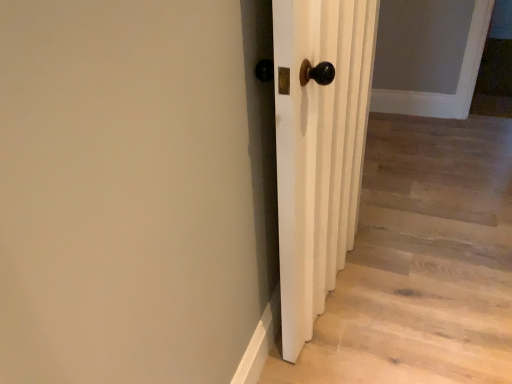
Describe the element at coordinates (318, 149) in the screenshot. I see `white wooden door at center` at that location.

Find the location of a particular element. The height and width of the screenshot is (384, 512). white wooden door at center is located at coordinates (318, 149).

The height and width of the screenshot is (384, 512). Identify the location of white matte door at center. (421, 263).

Image resolution: width=512 pixels, height=384 pixels. What do you see at coordinates (421, 263) in the screenshot?
I see `white matte door at center` at bounding box center [421, 263].

Find the location of a particular element. white wooden door at center is located at coordinates (318, 149).

Which object is positioned more to the left, white matte door at center or white wooden door at center?

Positioned to the left is white wooden door at center.

Which object is more forward, white matte door at center or white wooden door at center?

white wooden door at center is more forward.

Does point (368, 238) appear closer or farther from the camera than point (342, 36)?

Point (368, 238).

From the image's perspective, is white matte door at center above or below white wooden door at center?

white matte door at center is situated lower than white wooden door at center in the image.

From a real-world perspective, is white matte door at center on white wooden door at center?

No, from a real-world perspective, white matte door at center is not above white wooden door at center.

Can you confirm if white matte door at center is thinner than white wooden door at center?

No.

Considering the relative sizes of white matte door at center and white wooden door at center in the image provided, is white matte door at center taller than white wooden door at center?

No, white matte door at center is not taller than white wooden door at center.

Between white matte door at center and white wooden door at center, which one has smaller size?

With smaller size is white matte door at center.

Consider the image. Which is correct: white matte door at center is inside white wooden door at center, or outside of it?

white matte door at center is not inside white wooden door at center, it's outside.

Are white matte door at center and white wooden door at center far apart?

No.

From the picture: Could you tell me if white matte door at center is turned towards white wooden door at center?

No.

How distant is white matte door at center from white wooden door at center?

A distance of 51.02 centimeters exists between white matte door at center and white wooden door at center.

Locate an element on the screen. The height and width of the screenshot is (384, 512). stairwell located on the right of white wooden door at center is located at coordinates pyautogui.click(x=421, y=263).

Which object is positioned more to the right, white wooden door at center or white matte door at center?

white matte door at center is more to the right.

Between white wooden door at center and white matte door at center, which one is positioned behind?

white matte door at center.

Which point is more forward, (333,274) or (362,198)?

The point (333,274) is closer.

From the image's perspective, which is below, white wooden door at center or white matte door at center?

white matte door at center, from the image's perspective.

From a real-world perspective, is white wooden door at center on top of white matte door at center?

Yes, from a real-world perspective, white wooden door at center is above white matte door at center.

Considering the sizes of white wooden door at center and white matte door at center in the image, is white wooden door at center wider or thinner than white matte door at center?

In the image, white wooden door at center appears to be more narrow than white matte door at center.

Is white wooden door at center shorter than white matte door at center?

No, white wooden door at center is not shorter than white matte door at center.

Which of these two, white wooden door at center or white matte door at center, is smaller?

Smaller between the two is white matte door at center.

Is white wooden door at center not within white matte door at center?

That's correct, white wooden door at center is outside of white matte door at center.

Is white wooden door at center far away from white matte door at center?

Result: No, white wooden door at center is not far from white matte door at center.

Is white wooden door at center positioned with its back to white matte door at center?

No, white wooden door at center's orientation is not away from white matte door at center.

Where is `door in front of the white matte door at center`? This screenshot has width=512, height=384. door in front of the white matte door at center is located at coordinates (318, 149).

This screenshot has width=512, height=384. In the image, there is a white wooden door at center. Find the location of `stairwell below it (from a real-world perspective)`. stairwell below it (from a real-world perspective) is located at coordinates (421, 263).

Find the location of `stairwell behind the white wooden door at center`. stairwell behind the white wooden door at center is located at coordinates (421, 263).